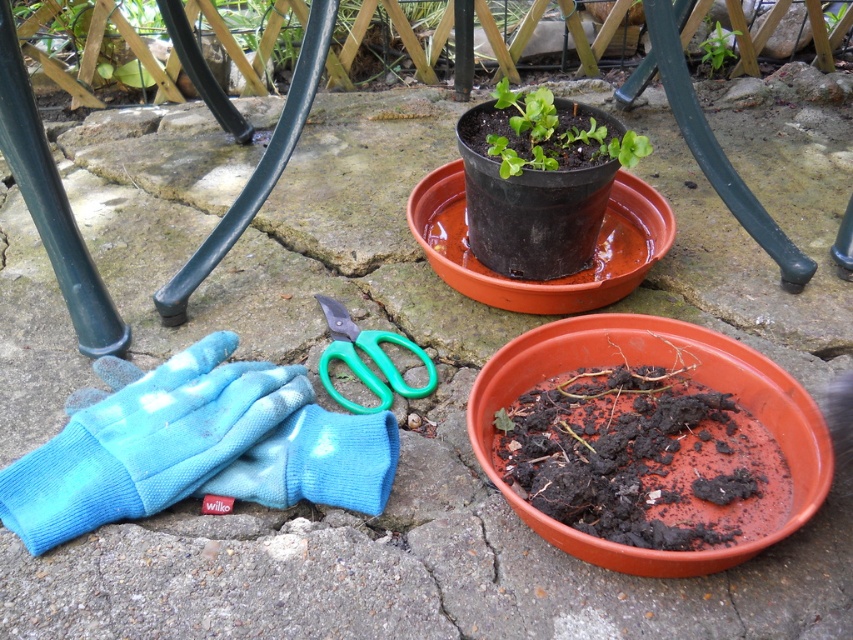
Can you confirm if dark brown soil at center is wider than blue fleece glove at lower left?

In fact, dark brown soil at center might be narrower than blue fleece glove at lower left.

The width and height of the screenshot is (853, 640). What do you see at coordinates (643, 460) in the screenshot? I see `dark brown soil at center` at bounding box center [643, 460].

This screenshot has height=640, width=853. What are the coordinates of `dark brown soil at center` in the screenshot? It's located at (643, 460).

Can you confirm if dark brown soil at center is positioned to the right of green leafy plant at upper center?

Incorrect, dark brown soil at center is not on the right side of green leafy plant at upper center.

Is point (718, 406) positioned after point (704, 54)?

No, (718, 406) is in front of (704, 54).

Between point (744, 429) and point (722, 52), which one is positioned behind?

Positioned behind is point (722, 52).

This screenshot has width=853, height=640. I want to click on dark brown soil at center, so click(643, 460).

Who is higher up, dark brown soil at center or green plastic scissors at center?

green plastic scissors at center is higher up.

Does dark brown soil at center appear over green plastic scissors at center?

No.

Between point (614, 477) and point (383, 396), which one is positioned in front?

Point (614, 477) is more forward.

Locate an element on the screen. dark brown soil at center is located at coordinates (643, 460).